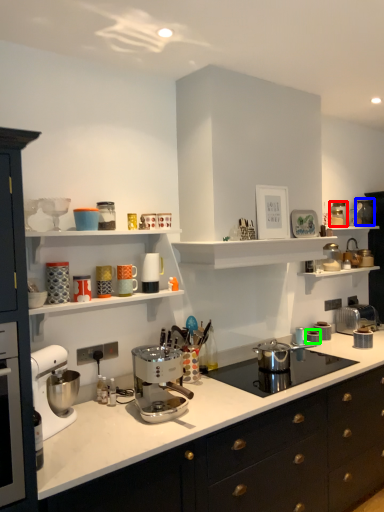
Question: Which is farther away from kitchen appliance (highlighted by a red box)? appliance (highlighted by a blue box) or appliance (highlighted by a green box)?

Choices:
 (A) appliance
 (B) appliance

Answer: (B)